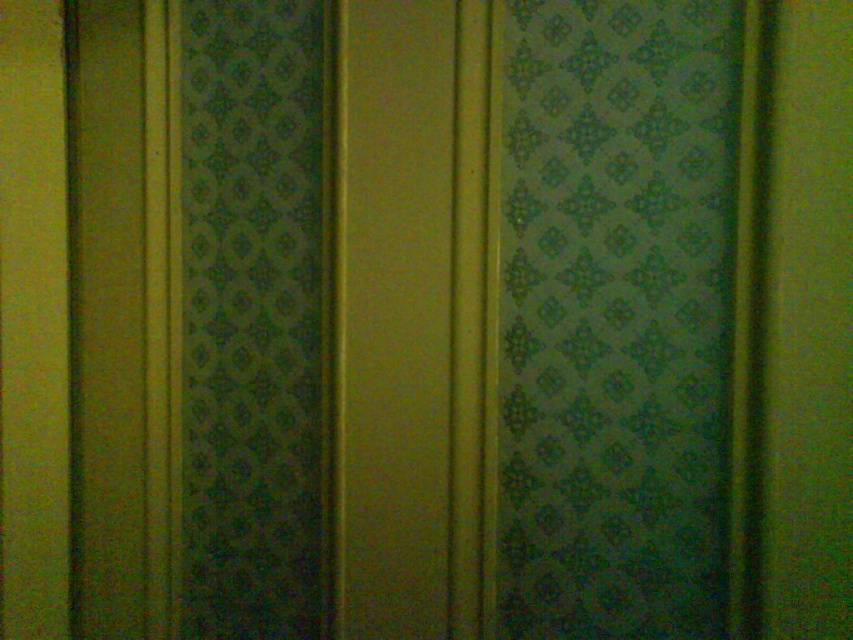
You are standing in a room with two green patterned curtains. The curtains are labeled as the green patterned curtain at right and the green patterned curtain at left. Which curtain is positioned lower on the wall?

The green patterned curtain at right is located below the green patterned curtain at left, so the green patterned curtain at right is positioned lower on the wall.

You are standing in a room with the wall described in the scene. You want to hang a painting that is 36 inches wide on the wall. The painting must be placed such that it does not overlap with the green patterned curtain at right. Given your current position, can the painting fit without overlapping the curtain?

The distance between the green patterned curtain at right and the camera is 37.55 inches. Since the painting is 36 inches wide, it can fit within that distance as long as it is positioned to the left of the curtain, ensuring no overlap.

In the scene shown: You are standing in a room with two green patterned curtains. The curtains are described as the green patterned curtain at right and the green patterned curtain at left. Which curtain has a greater width?

The green patterned curtain at right has a greater width than the green patterned curtain at left.